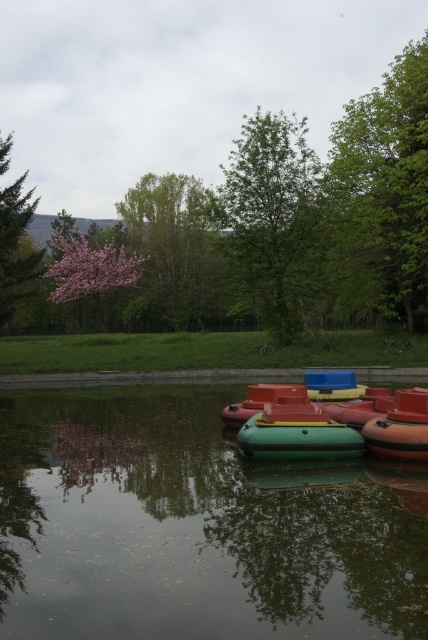
Question: Which of the following is the farthest from the observer?

Choices:
 (A) pink blossoms at upper left
 (B) glossy plastic boats at center

Answer: (A)

Question: Which object appears farthest from the camera in this image?

Choices:
 (A) pink blossoming tree at upper left
 (B) glossy plastic boats at center
 (C) pink blossoms at upper left
 (D) green rubber boat at center

Answer: (A)

Question: Which point is farther to the camera?

Choices:
 (A) (118, 285)
 (B) (395, 246)
 (C) (155, 195)

Answer: (C)

Question: Observing the image, what is the correct spatial positioning of glossy plastic boats at center in reference to pink blossoming tree at upper left?

Choices:
 (A) left
 (B) right

Answer: (B)

Question: Does pink blossoming tree at upper left lie in front of green matte tree at left?

Choices:
 (A) no
 (B) yes

Answer: (B)

Question: Does green leafy tree at upper right lie behind pink blossoming tree at upper left?

Choices:
 (A) yes
 (B) no

Answer: (B)